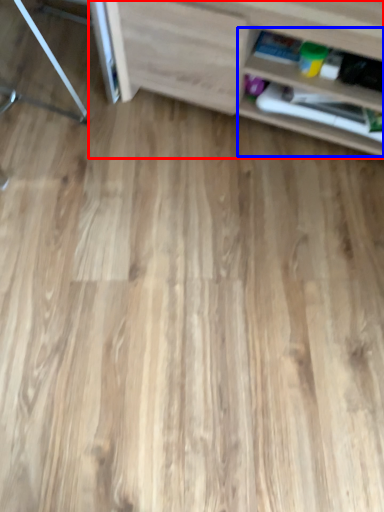
Question: Which object appears closest to the camera in this image, shelf (highlighted by a red box) or shelf (highlighted by a blue box)?

Choices:
 (A) shelf
 (B) shelf

Answer: (A)